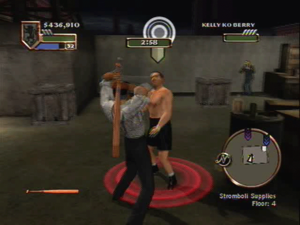
Identify the location of floor. The width and height of the screenshot is (300, 225). (76, 151).